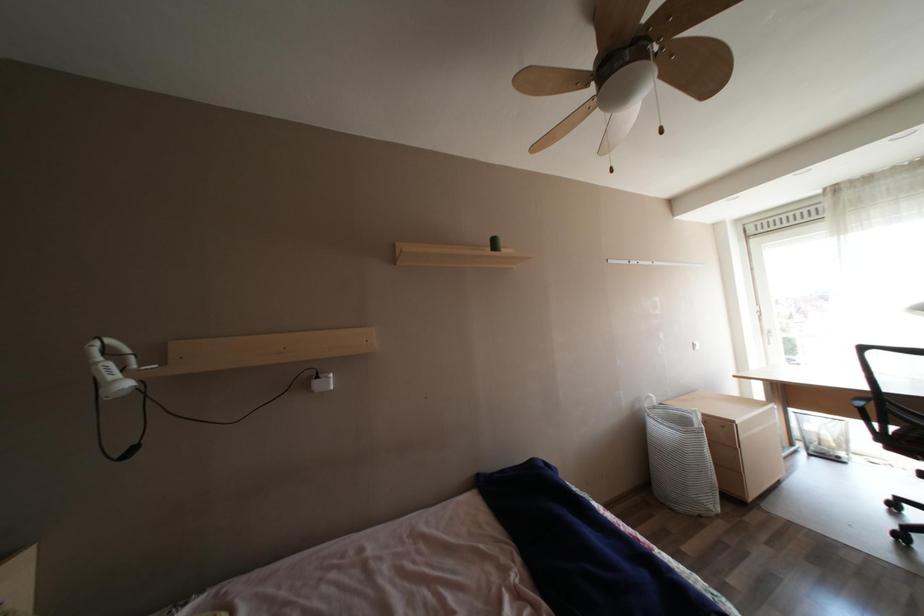
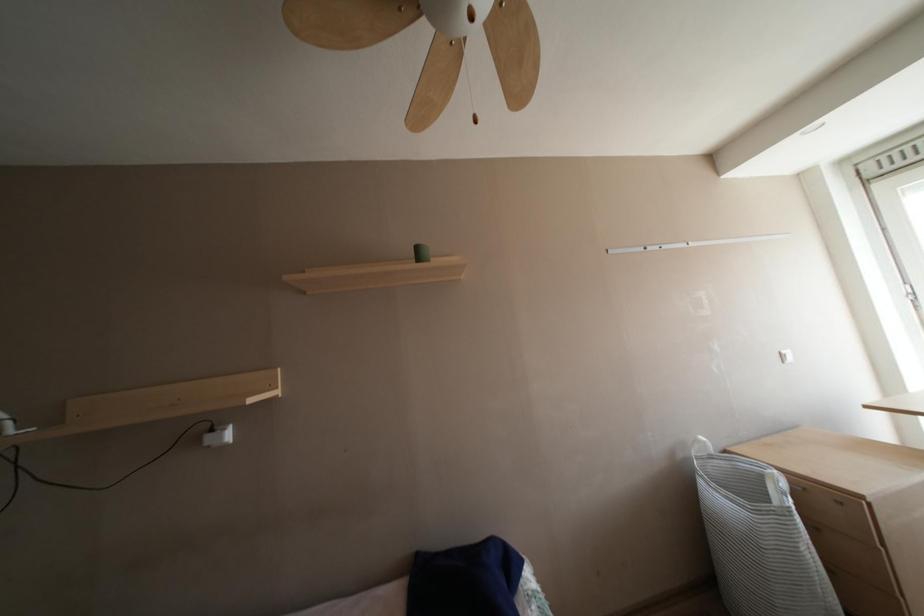
In a continuous first-person perspective shot, in which direction is the camera moving?

The cameraman moved toward right, forward.